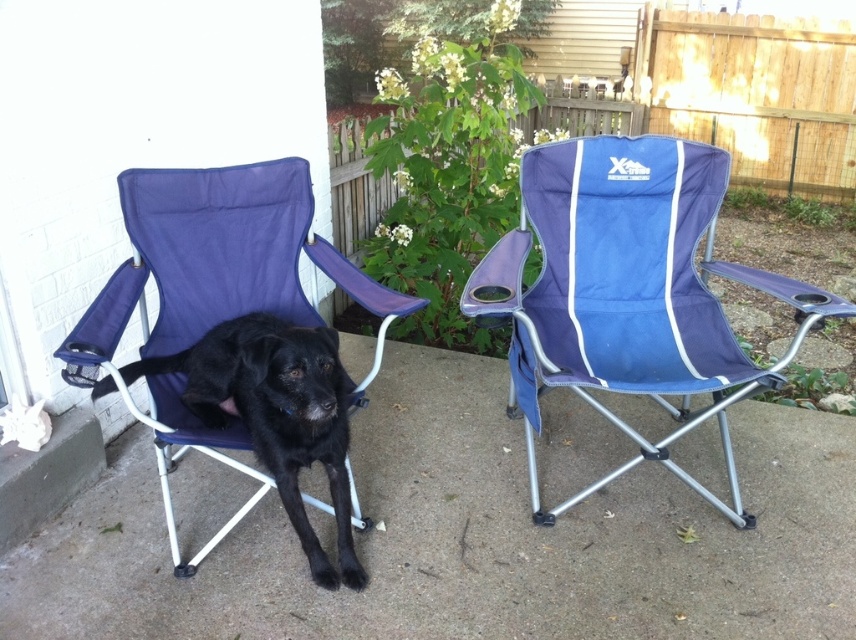
You are standing at the point with coordinates (627, 292). Which object are you currently on?

You are on the blue fabric folding chair at center.

In the scene shown: You are a service robot tasked with fetching a water bowl for the black matte dog at left. The water bowl is located at the blue fabric folding chair at center. Can you reach the water bowl from the dog without moving the chair?

The distance between the blue fabric folding chair at center and the black matte dog at left is 29.40 inches, so yes, the robot can reach the water bowl from the dog without moving the chair since the distance is manageable for the robot to traverse.